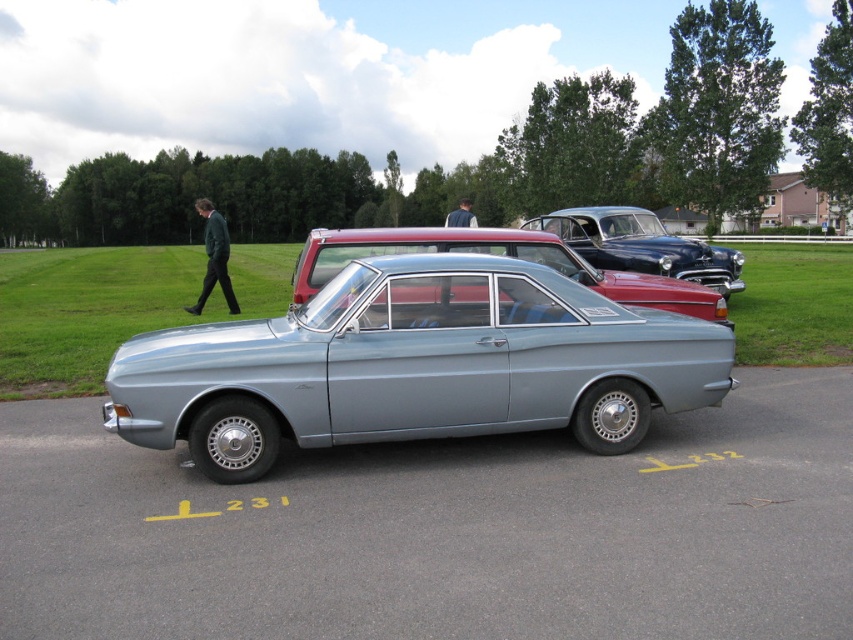
You are a parking attendant trying to fit a new car into the space between the metallic silver car at center and the shiny blue car at center. The new car is 1.8 meters wide. Can you safely park the new car there?

The metallic silver car at center might be wider than shiny blue car at center, so the space between them may not be wide enough for a 1.8 meter wide car. Check the actual width before deciding.